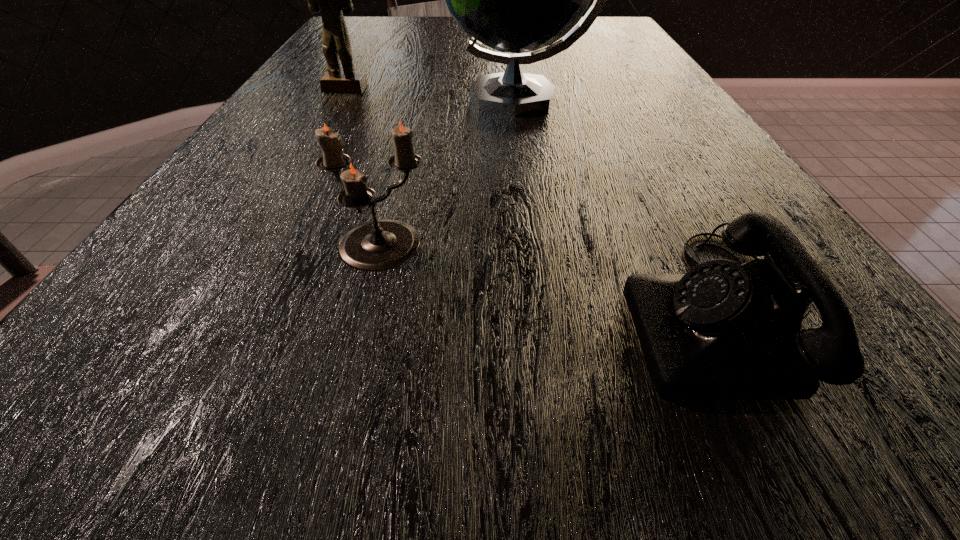
You are a GUI agent. You are given a task and a screenshot of the screen. Output one action in this format:
    pyautogui.click(x=<x>, y=<y>)
    Task: Click on the vacant point located on the front face of the telephone
    The image size is (960, 540).
    Given the screenshot: What is the action you would take?
    pyautogui.click(x=437, y=312)

Find the location of a particular element. vacant area located on the front face of the telephone is located at coordinates [x=341, y=312].

Find the location of a particular element. The height and width of the screenshot is (540, 960). free spot located 0.310m on the front face of the telephone is located at coordinates (358, 312).

Image resolution: width=960 pixels, height=540 pixels. I want to click on object present at the near edge, so click(723, 331).

Image resolution: width=960 pixels, height=540 pixels. I want to click on object that is at the left edge, so click(x=330, y=0).

This screenshot has width=960, height=540. Identify the location of object located at the right edge. (723, 331).

Find the location of a particular element. The image size is (960, 540). object present at the near right corner is located at coordinates (723, 331).

In the image, there is a desktop. Where is `free space at the far edge`? Image resolution: width=960 pixels, height=540 pixels. free space at the far edge is located at coordinates (412, 39).

Where is `vacant space at the near edge`? vacant space at the near edge is located at coordinates (287, 494).

You are a GUI agent. You are given a task and a screenshot of the screen. Output one action in this format:
    pyautogui.click(x=<x>, y=<y>)
    Task: Click on the blank space at the left edge of the desktop
    
    Given the screenshot: What is the action you would take?
    pyautogui.click(x=239, y=202)